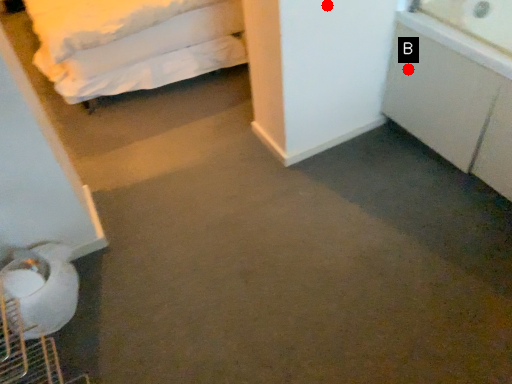
Question: Two points are circled on the image, labeled by A and B beside each circle. Which point is further to the camera?

Choices:
 (A) A is further
 (B) B is further

Answer: (B)